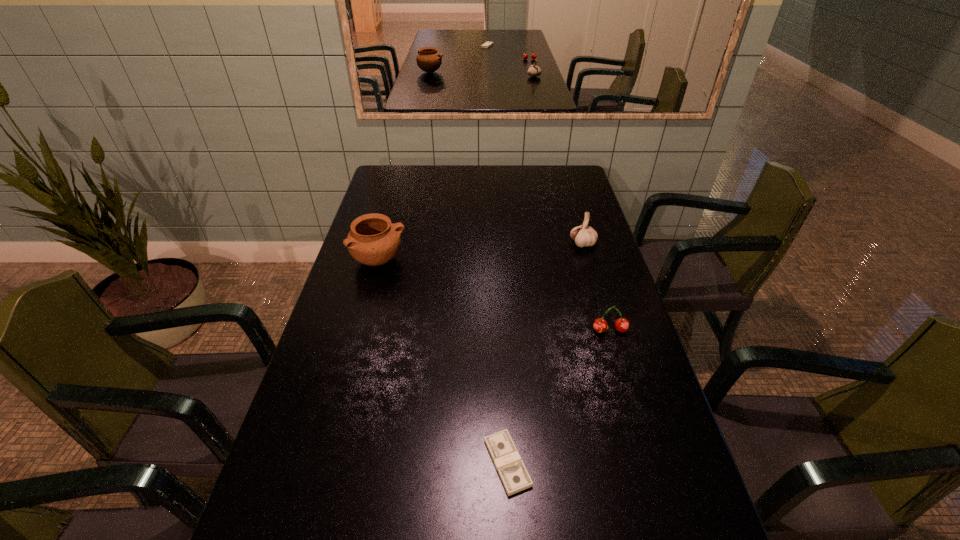
Identify the location of free spot between the second object from left to right and the third shortest object. This screenshot has height=540, width=960. (545, 353).

This screenshot has width=960, height=540. What are the coordinates of `vacant area that lies between the second shortest object and the garlic` in the screenshot? It's located at (596, 287).

Where is `unoccupied area between the second nearest object and the garlic`? The height and width of the screenshot is (540, 960). unoccupied area between the second nearest object and the garlic is located at coordinates (596, 287).

Find the location of a particular element. vacant point located between the third shortest object and the second object from left to right is located at coordinates (545, 353).

Locate an element on the screen. Image resolution: width=960 pixels, height=540 pixels. unoccupied area between the second shortest object and the garlic is located at coordinates (596, 287).

This screenshot has width=960, height=540. In order to click on vacant region between the dollar and the tallest object in this screenshot , I will do `click(444, 361)`.

The image size is (960, 540). Identify the location of free space between the third shortest object and the third tallest object. (596, 287).

What are the coordinates of `object that ranks as the closest to the second tallest object` in the screenshot? It's located at (600, 325).

Locate which object ranks second in proximity to the third shortest object. Please provide its 2D coordinates. Your answer should be formatted as a tuple, i.e. [(x, y)], where the tuple contains the x and y coordinates of a point satisfying the conditions above.

[(373, 240)]

Locate an element on the screen. free spot that satisfies the following two spatial constraints: 1. on the back side of the second tallest object; 2. on the right side of the leftmost object is located at coordinates (384, 244).